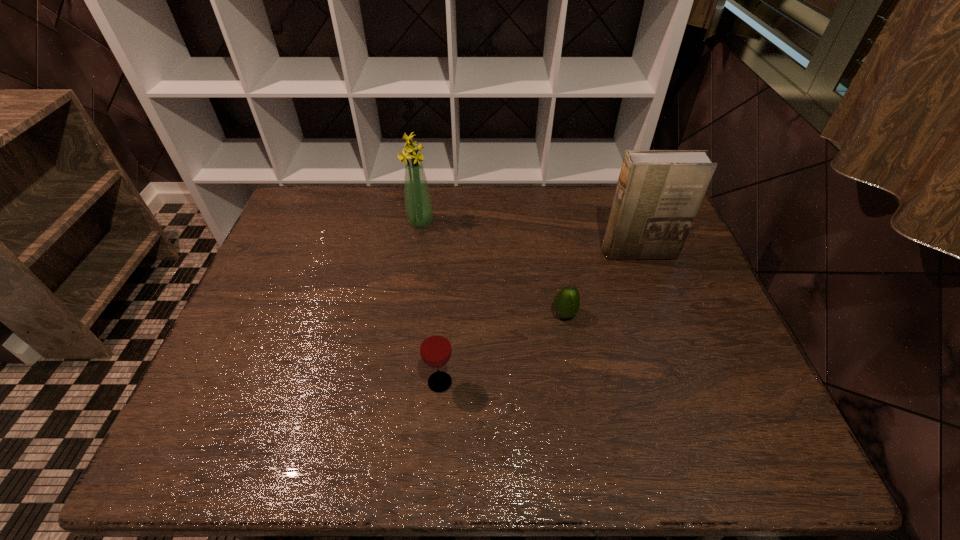
The height and width of the screenshot is (540, 960). I want to click on phonebook, so click(658, 194).

Locate an element on the screen. This screenshot has height=540, width=960. the second farthest object is located at coordinates (658, 194).

At what (x,y) coordinates should I click in order to perform the action: click on the leftmost object. Please return your answer as a coordinate pair (x, y). This screenshot has height=540, width=960. Looking at the image, I should click on 418,204.

I want to click on bouquet, so click(418, 204).

Where is `the nearest object`? The height and width of the screenshot is (540, 960). the nearest object is located at coordinates pos(435,347).

Image resolution: width=960 pixels, height=540 pixels. In order to click on the third object from right to left in this screenshot , I will do `click(435, 347)`.

The image size is (960, 540). I want to click on the third object from left to right, so click(x=567, y=302).

This screenshot has width=960, height=540. I want to click on the second nearest object, so click(x=567, y=302).

Identify the location of vacant space located 0.190m on the cover of the phonebook. (658, 309).

Where is `free space located on the front-facing side of the farthest object`? The image size is (960, 540). free space located on the front-facing side of the farthest object is located at coordinates (494, 221).